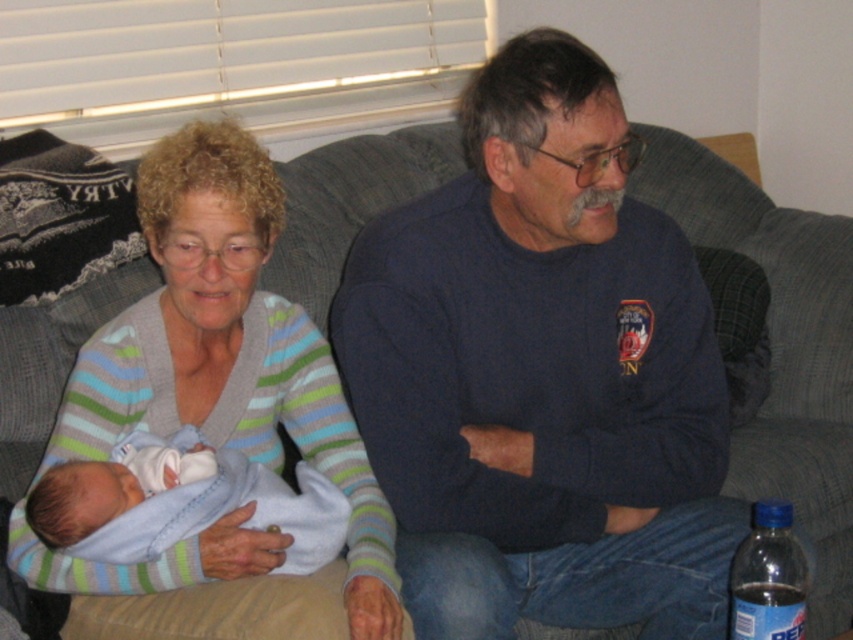
You are a photographer taking a picture of the dark blue sweater at center and the light blue soft fabric newborn at center. Which object should you focus on if you want to capture the wider one?

The dark blue sweater at center might be wider than light blue soft fabric newborn at center, so focus on the dark blue sweater at center to capture the wider one.

You are a tailor who needs to measure two items in the living room to decide which one needs a larger fabric. You see the striped sweater at center and the light blue soft fabric newborn at center. Which item requires more fabric?

The striped sweater at center requires more fabric because it is bigger than the light blue soft fabric newborn at center.

You are a photographer taking a portrait of the striped sweater at center and the light blue soft fabric newborn at center. Which object should you focus on first to ensure both are in sharp focus?

The striped sweater at center is in front of the light blue soft fabric newborn at center, so you should focus on the striped sweater at center first to ensure both are in sharp focus.